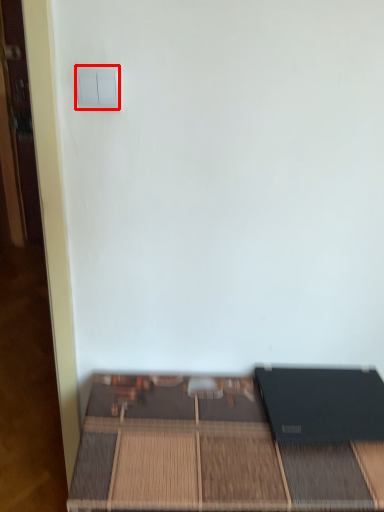
Question: Where is light switch (annotated by the red box) located in relation to furniture in the image?

Choices:
 (A) left
 (B) right

Answer: (A)